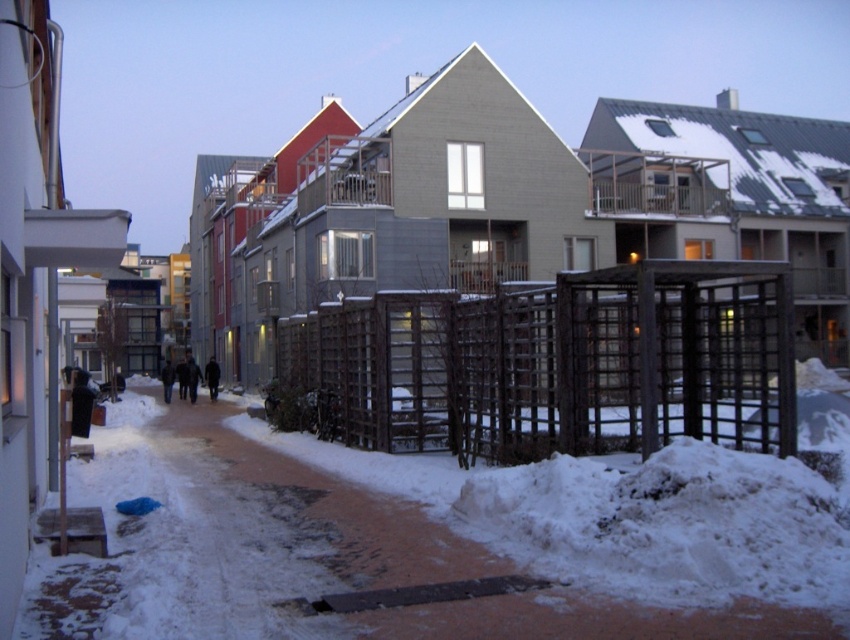
Which is behind, point (72, 634) or point (553, 444)?

Point (553, 444)

Is point (132, 554) positioned behind point (743, 424)?

No, (132, 554) is in front of (743, 424).

Between point (162, 529) and point (508, 445), which one is positioned in front?

Positioned in front is point (162, 529).

You are a GUI agent. You are given a task and a screenshot of the screen. Output one action in this format:
    pyautogui.click(x=<x>, y=<y>)
    Task: Click on the brown concrete pavement at center
    This screenshot has width=850, height=640.
    Given the screenshot: What is the action you would take?
    pyautogui.click(x=307, y=557)